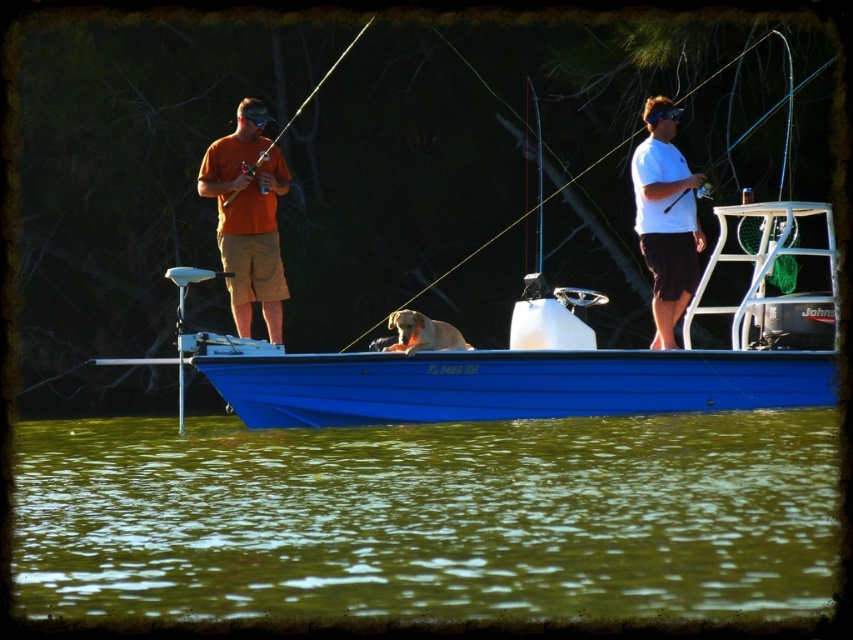
Which is behind, point (643, 173) or point (328, 76)?

Point (328, 76)

Locate an element on the screen. white matte shirt at right is located at coordinates (665, 218).

Where is `white matte shirt at right`? white matte shirt at right is located at coordinates (665, 218).

Can you confirm if green algae water at lower center is taller than orange cotton shirt at center?

In fact, green algae water at lower center may be shorter than orange cotton shirt at center.

Does point (624, 417) come farther from viewer compared to point (267, 209)?

No, it is in front of (267, 209).

Locate an element on the screen. green algae water at lower center is located at coordinates (427, 516).

From the picture: Does orange cotton shirt at center appear on the right side of white matte shirt at right?

No, orange cotton shirt at center is not to the right of white matte shirt at right.

Between orange cotton shirt at center and white matte shirt at right, which one appears on the left side from the viewer's perspective?

Positioned to the left is orange cotton shirt at center.

Who is more distant from viewer, (271,317) or (663,161)?

The point (271,317) is behind.

I want to click on orange cotton shirt at center, so click(x=248, y=216).